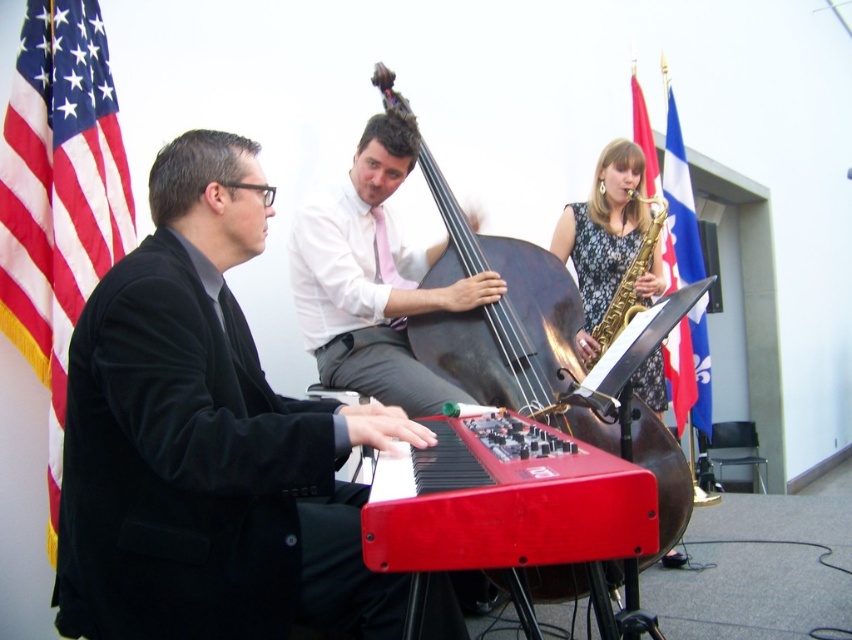
Who is more forward, (321, 211) or (591, 336)?

Point (321, 211) is more forward.

Does pink silk tie at center appear under floral dress at upper center?

Yes, pink silk tie at center is below floral dress at upper center.

The width and height of the screenshot is (852, 640). Find the location of `pink silk tie at center`. pink silk tie at center is located at coordinates (372, 276).

Where is `pink silk tie at center`? This screenshot has width=852, height=640. pink silk tie at center is located at coordinates (372, 276).

Between shiny red keyboard at center and shiny black cello at center, which one has less height?

shiny red keyboard at center

Does shiny red keyboard at center appear on the right side of shiny black cello at center?

No, shiny red keyboard at center is not to the right of shiny black cello at center.

What do you see at coordinates (510, 502) in the screenshot?
I see `shiny red keyboard at center` at bounding box center [510, 502].

Locate an element on the screen. The width and height of the screenshot is (852, 640). shiny red keyboard at center is located at coordinates (510, 502).

Can you confirm if shiny red keyboard at center is positioned below blue fabric flag at upper right?

Indeed, shiny red keyboard at center is positioned under blue fabric flag at upper right.

Does shiny red keyboard at center have a larger size compared to blue fabric flag at upper right?

No.

This screenshot has width=852, height=640. Describe the element at coordinates (510, 502) in the screenshot. I see `shiny red keyboard at center` at that location.

This screenshot has height=640, width=852. In order to click on shiny red keyboard at center in this screenshot , I will do `click(510, 502)`.